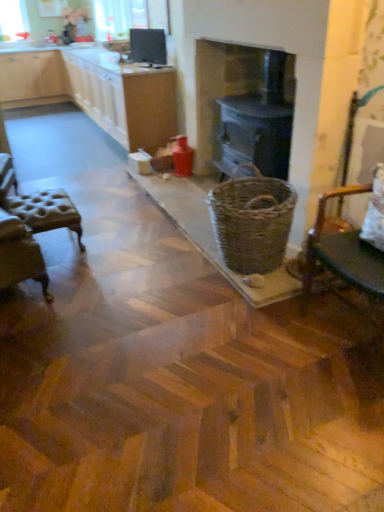
The image size is (384, 512). What do you see at coordinates (221, 90) in the screenshot?
I see `dark gray wood stove at center` at bounding box center [221, 90].

The width and height of the screenshot is (384, 512). What are the coordinates of `transparent plastic window screen at upper left` in the screenshot? It's located at [x=13, y=18].

Image resolution: width=384 pixels, height=512 pixels. Describe the element at coordinates (33, 79) in the screenshot. I see `light wood cabinetry at upper left, placed as the second cabinetry when sorted from front to back` at that location.

Measure the distance between point (39,68) and camera.

The depth of point (39,68) is 6.82 meters.

What do you see at coordinates (343, 252) in the screenshot? Image resolution: width=384 pixels, height=512 pixels. I see `wooden chair at right, placed as the 1th chair when sorted from front to back` at bounding box center [343, 252].

Where is `matte black monitor at upper center`? matte black monitor at upper center is located at coordinates pyautogui.click(x=148, y=45).

Is white wood cabinets at upper left, the 2th cabinetry positioned from the back, directly adjacent to woven brown basket at center?

No, white wood cabinets at upper left, the 2th cabinetry positioned from the back, is not touching woven brown basket at center.

From the image's perspective, is white wood cabinets at upper left, which appears as the 1th cabinetry when viewed from the front, located above or below woven brown basket at center?

Based on their image positions, white wood cabinets at upper left, which appears as the 1th cabinetry when viewed from the front, is located above woven brown basket at center.

Looking at this image, what's the angular difference between white wood cabinets at upper left, the 2th cabinetry positioned from the back, and woven brown basket at center's facing directions?

90.8 degrees.

Which of these two, white wood cabinets at upper left, which appears as the 1th cabinetry when viewed from the front, or woven brown basket at center, is smaller?

woven brown basket at center.

Is point (23, 91) less distant than point (145, 61)?

That is False.

Is white wood cabinets at upper left, which appears as the 1th cabinetry when viewed from the front, wider than matte black monitor at upper center?

Yes.

Which of these two, white wood cabinets at upper left, the 2th cabinetry positioned from the back, or matte black monitor at upper center, is bigger?

Bigger between the two is white wood cabinets at upper left, the 2th cabinetry positioned from the back.

Is light wood cabinetry at upper left, placed as the second cabinetry when sorted from front to back, shorter than transparent plastic window screen at upper left?

In fact, light wood cabinetry at upper left, placed as the second cabinetry when sorted from front to back, may be taller than transparent plastic window screen at upper left.

Could you tell me if light wood cabinetry at upper left, the 1th cabinetry viewed from the back, is facing transparent plastic window screen at upper left?

No, light wood cabinetry at upper left, the 1th cabinetry viewed from the back, is not oriented towards transparent plastic window screen at upper left.

Which object is thinner, light wood cabinetry at upper left, placed as the second cabinetry when sorted from front to back, or transparent plastic window screen at upper left?

transparent plastic window screen at upper left is thinner.

From the image's perspective, is light wood cabinetry at upper left, placed as the second cabinetry when sorted from front to back, located above or below transparent plastic window screen at upper left?

light wood cabinetry at upper left, placed as the second cabinetry when sorted from front to back, is below transparent plastic window screen at upper left.

Does woven brown basket at center have a greater width compared to matte black monitor at upper center?

Yes.

Is woven brown basket at center positioned with its back to matte black monitor at upper center?

No, woven brown basket at center's orientation is not away from matte black monitor at upper center.

Considering the relative positions of woven brown basket at center and matte black monitor at upper center in the image provided, is woven brown basket at center in front of matte black monitor at upper center?

Yes, woven brown basket at center is closer to the viewer.

Can you confirm if dark gray wood stove at center is thinner than matte black monitor at upper center?

In fact, dark gray wood stove at center might be wider than matte black monitor at upper center.

Is the depth of dark gray wood stove at center less than that of matte black monitor at upper center?

That is True.

From the picture: Considering the relative sizes of dark gray wood stove at center and matte black monitor at upper center in the image provided, is dark gray wood stove at center bigger than matte black monitor at upper center?

Correct, dark gray wood stove at center is larger in size than matte black monitor at upper center.

Does point (239, 81) come farther from viewer compared to point (158, 32)?

No, (239, 81) is closer to viewer.

Which point is more forward, (x=133, y=124) or (x=38, y=80)?

The point (x=133, y=124) is closer.

Is white wood cabinets at upper left, which appears as the 1th cabinetry when viewed from the front, aimed at light wood cabinetry at upper left, placed as the second cabinetry when sorted from front to back?

No.

Image resolution: width=384 pixels, height=512 pixels. What are the coordinates of `cabinetry that is below the light wood cabinetry at upper left, the 1th cabinetry viewed from the back (from the image's perspective)` in the screenshot? It's located at (96, 91).

Is wooden chair at right, placed as the 1th chair when sorted from front to back, positioned before woven brown basket at center?

That is True.

Considering the sizes of wooden chair at right, the 2th chair from the left, and woven brown basket at center in the image, is wooden chair at right, the 2th chair from the left, wider or thinner than woven brown basket at center?

Considering their sizes, wooden chair at right, the 2th chair from the left, looks broader than woven brown basket at center.

Is point (322, 247) positioned after point (272, 211)?

That is False.

At what (x,y) coordinates should I click in order to perform the action: click on basket that is below the white wood cabinets at upper left, which appears as the 1th cabinetry when viewed from the front (from the image's perspective). Please return your answer as a coordinate pair (x, y). This screenshot has width=384, height=512. Looking at the image, I should click on (252, 220).

Find the location of a particular element. This screenshot has height=512, width=384. cabinetry that is the 1st one when counting leftward from the matte black monitor at upper center is located at coordinates (96, 91).

Estimate the real-world distances between objects in this image. Which object is closer to wooden chair at right, which appears as the second chair when viewed from the back, white wood cabinets at upper left, which appears as the 1th cabinetry when viewed from the front, or light wood cabinetry at upper left, the 1th cabinetry viewed from the back?

white wood cabinets at upper left, which appears as the 1th cabinetry when viewed from the front, is closer to wooden chair at right, which appears as the second chair when viewed from the back.

Looking at the image, which one is located closer to tufted leather stool at left, placed as the second chair when sorted from front to back, dark gray wood stove at center or white wood cabinets at upper left, which appears as the 1th cabinetry when viewed from the front?

The object closer to tufted leather stool at left, placed as the second chair when sorted from front to back, is dark gray wood stove at center.

Considering their positions, is transparent plastic window screen at upper left positioned closer to dark gray wood stove at center than woven brown basket at center?

woven brown basket at center lies closer to dark gray wood stove at center than the other object.

Which object lies further to the anchor point light wood cabinetry at upper left, the 1th cabinetry viewed from the back, wooden chair at right, the first chair when ordered from right to left, or woven brown basket at center?

Among the two, wooden chair at right, the first chair when ordered from right to left, is located further to light wood cabinetry at upper left, the 1th cabinetry viewed from the back.

Considering their positions, is matte black monitor at upper center positioned closer to white wood cabinets at upper left, the 2th cabinetry positioned from the back, than dark gray wood stove at center?

Among the two, matte black monitor at upper center is located nearer to white wood cabinets at upper left, the 2th cabinetry positioned from the back.

Estimate the real-world distances between objects in this image. Which object is closer to wooden chair at right, placed as the 1th chair when sorted from front to back, tufted leather stool at left, placed as the second chair when sorted from front to back, or white wood cabinets at upper left, which appears as the 1th cabinetry when viewed from the front?

The object closer to wooden chair at right, placed as the 1th chair when sorted from front to back, is tufted leather stool at left, placed as the second chair when sorted from front to back.

From the image, which object appears to be nearer to white wood cabinets at upper left, the 2th cabinetry positioned from the back, dark gray wood stove at center or light wood cabinetry at upper left, placed as the second cabinetry when sorted from front to back?

Among the two, light wood cabinetry at upper left, placed as the second cabinetry when sorted from front to back, is located nearer to white wood cabinets at upper left, the 2th cabinetry positioned from the back.

In the scene shown: From the image, which object appears to be farther from white wood cabinets at upper left, which appears as the 1th cabinetry when viewed from the front, dark gray wood stove at center or tufted leather stool at left, which ranks as the 1th chair in left-to-right order?

The object further to white wood cabinets at upper left, which appears as the 1th cabinetry when viewed from the front, is tufted leather stool at left, which ranks as the 1th chair in left-to-right order.

This screenshot has height=512, width=384. I want to click on chair positioned between dark gray wood stove at center and transparent plastic window screen at upper left from near to far, so coord(38,205).

The width and height of the screenshot is (384, 512). I want to click on cabinetry positioned between white wood cabinets at upper left, the 2th cabinetry positioned from the back, and transparent plastic window screen at upper left from near to far, so click(33, 79).

At what (x,y) coordinates should I click in order to perform the action: click on appliance between white wood cabinets at upper left, the 2th cabinetry positioned from the back, and light wood cabinetry at upper left, placed as the second cabinetry when sorted from front to back, in the front-back direction. Please return your answer as a coordinate pair (x, y). This screenshot has width=384, height=512. Looking at the image, I should click on (148, 45).

I want to click on fireplace between woven brown basket at center and matte black monitor at upper center in the front-back direction, so click(x=221, y=90).